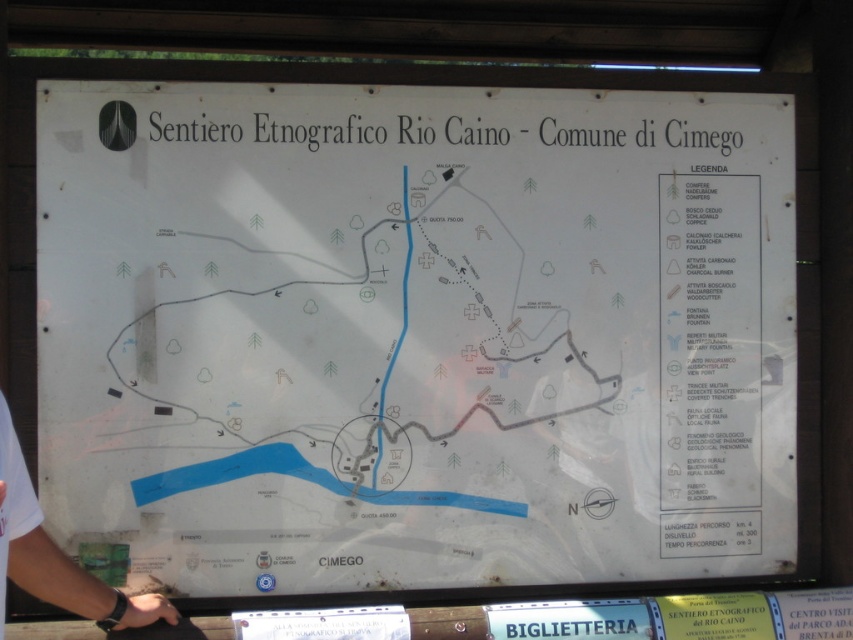
Which is in front, point (103, 179) or point (7, 449)?

Point (7, 449)

Between point (338, 138) and point (71, 608), which one is positioned behind?

Positioned behind is point (338, 138).

Locate an element on the screen. This screenshot has height=640, width=853. white paper map at center is located at coordinates pyautogui.click(x=415, y=333).